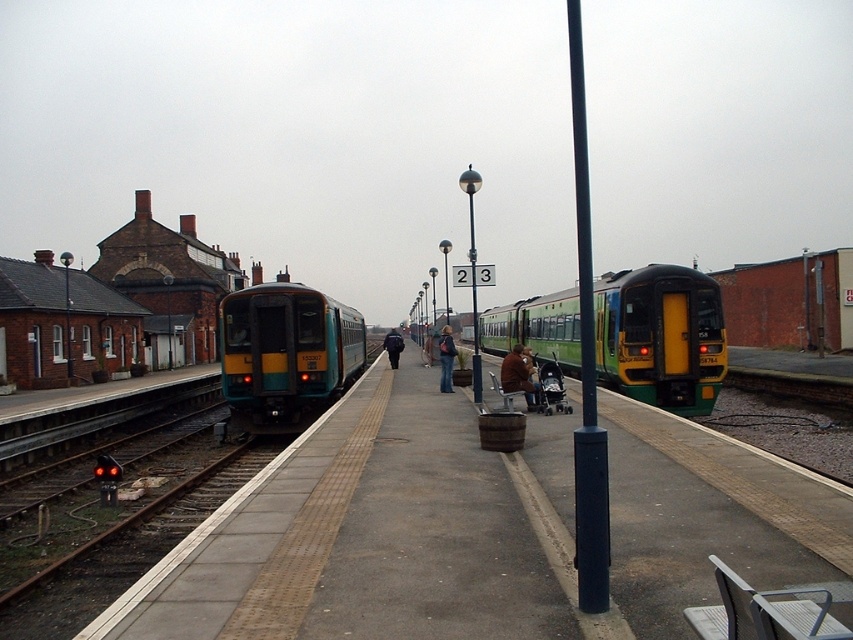
Which of these two, green/yellow plastic train at center or teal/yellow metal train at center, stands shorter?

With less height is green/yellow plastic train at center.

Is green/yellow plastic train at center to the left of teal/yellow metal train at center from the viewer's perspective?

No, green/yellow plastic train at center is not to the left of teal/yellow metal train at center.

Describe the element at coordinates (660, 337) in the screenshot. This screenshot has width=853, height=640. I see `green/yellow plastic train at center` at that location.

What are the coordinates of `green/yellow plastic train at center` in the screenshot? It's located at [660, 337].

Does green/yellow plastic train at center have a lesser height compared to brown leather jacket at center?

No.

Does green/yellow plastic train at center lie behind brown leather jacket at center?

No, it is in front of brown leather jacket at center.

Does point (666, 278) lie in front of point (520, 356)?

No, (666, 278) is further to viewer.

In order to click on green/yellow plastic train at center in this screenshot , I will do `click(660, 337)`.

Consider the image. Who is positioned more to the right, teal/yellow metal train at center or brown leather jacket at center?

brown leather jacket at center

Locate an element on the screen. teal/yellow metal train at center is located at coordinates (286, 353).

Locate an element on the screen. The height and width of the screenshot is (640, 853). teal/yellow metal train at center is located at coordinates (286, 353).

Where is `teal/yellow metal train at center`? This screenshot has height=640, width=853. teal/yellow metal train at center is located at coordinates (286, 353).